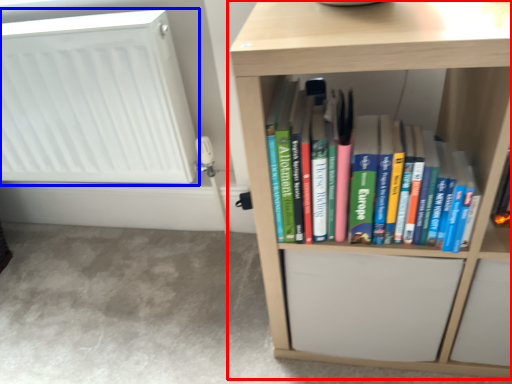
Question: Which object appears closest to the camera in this image, shelf (highlighted by a red box) or radiator (highlighted by a blue box)?

Choices:
 (A) shelf
 (B) radiator

Answer: (A)